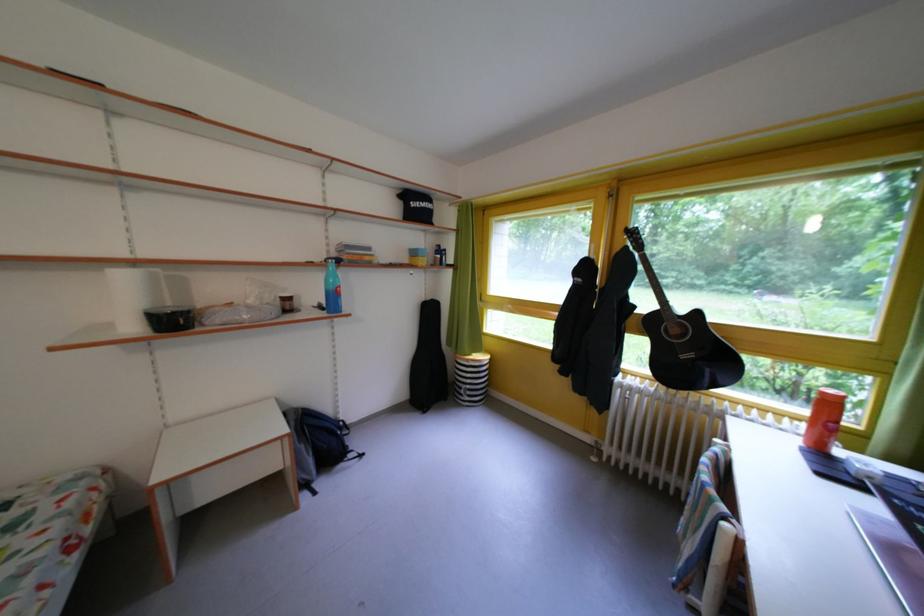
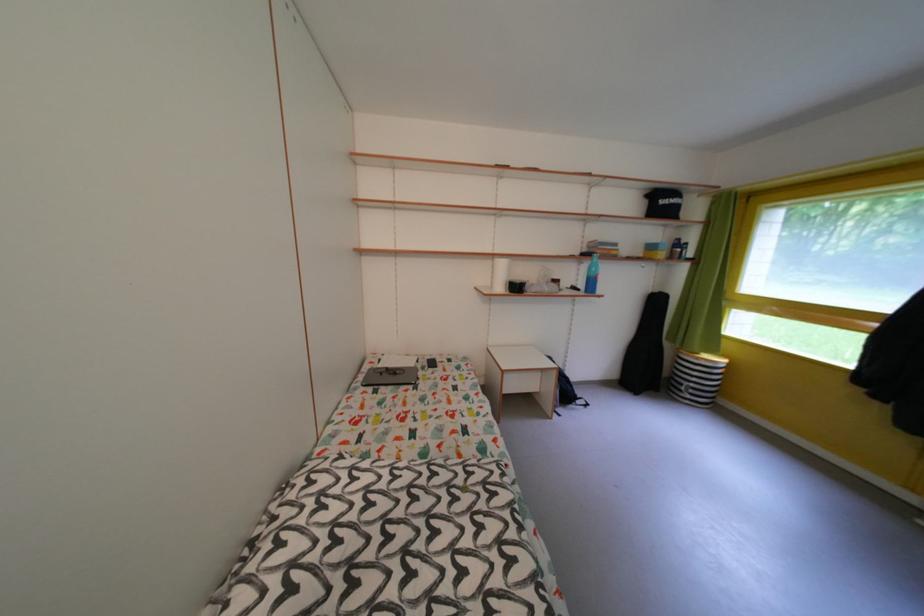
The point at (x=337, y=244) is marked in the first image. Where is the corresponding point in the second image?

(592, 243)